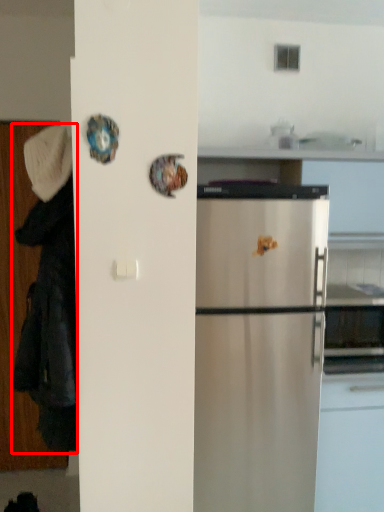
Question: From the image's perspective, what is the correct spatial relationship of couple (annotated by the red box) in relation to hat?

Choices:
 (A) below
 (B) above

Answer: (A)